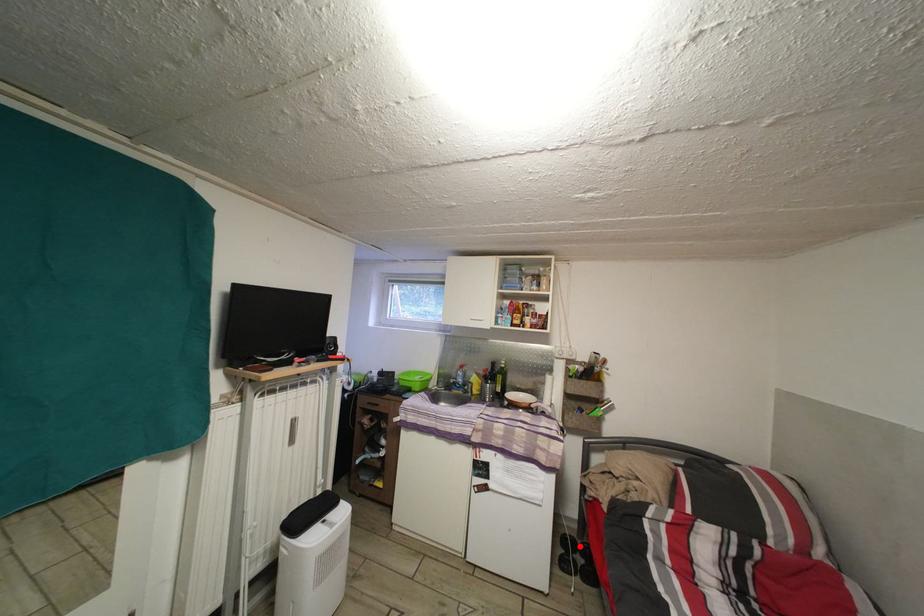
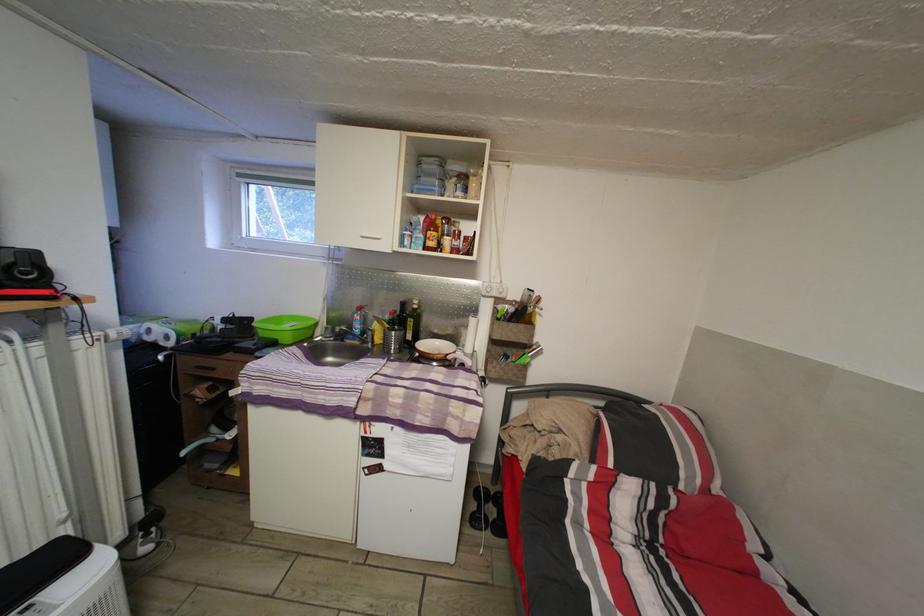
In the second image, find the point that corresponds to the highlighted location in the first image.

(493, 498)